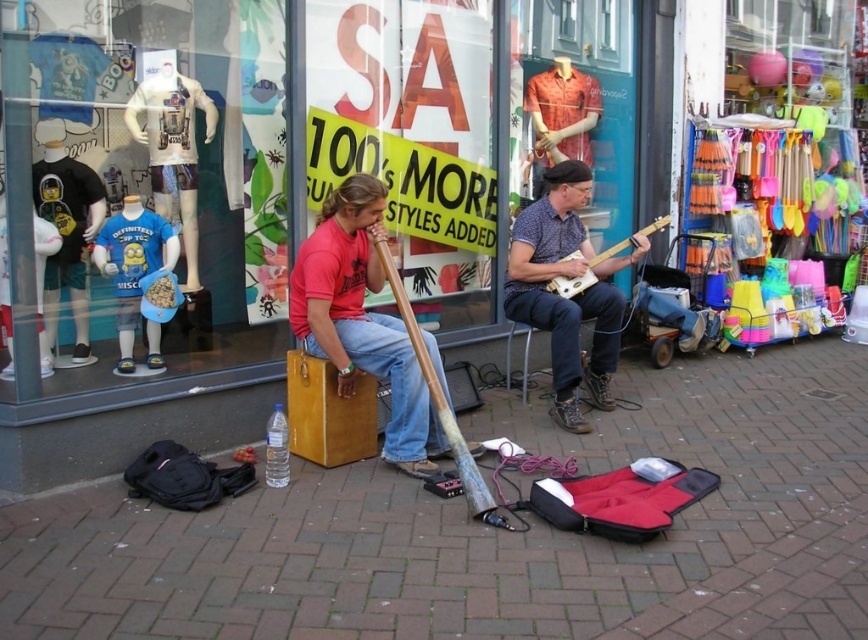
Does brick pavement at center appear on the right side of blue denim jeans at center?

No, brick pavement at center is not to the right of blue denim jeans at center.

Who is more distant from viewer, [771,536] or [553,186]?

Positioned behind is point [553,186].

The height and width of the screenshot is (640, 868). I want to click on brick pavement at center, so click(494, 532).

Is brick pavement at center thinner than wooden stick at center?

No.

Which is in front, point (791, 589) or point (472, 502)?

Point (791, 589) is in front.

Find the location of a particular element. brick pavement at center is located at coordinates (494, 532).

Locate an element on the screen. The height and width of the screenshot is (640, 868). brick pavement at center is located at coordinates tap(494, 532).

Does brick pavement at center have a lesser width compared to light brown wood electric guitar at center?

Incorrect, brick pavement at center's width is not less than light brown wood electric guitar at center's.

Who is more forward, (100,512) or (569,284)?

Point (100,512)

This screenshot has height=640, width=868. What do you see at coordinates (494, 532) in the screenshot? I see `brick pavement at center` at bounding box center [494, 532].

Locate an element on the screen. brick pavement at center is located at coordinates (494, 532).